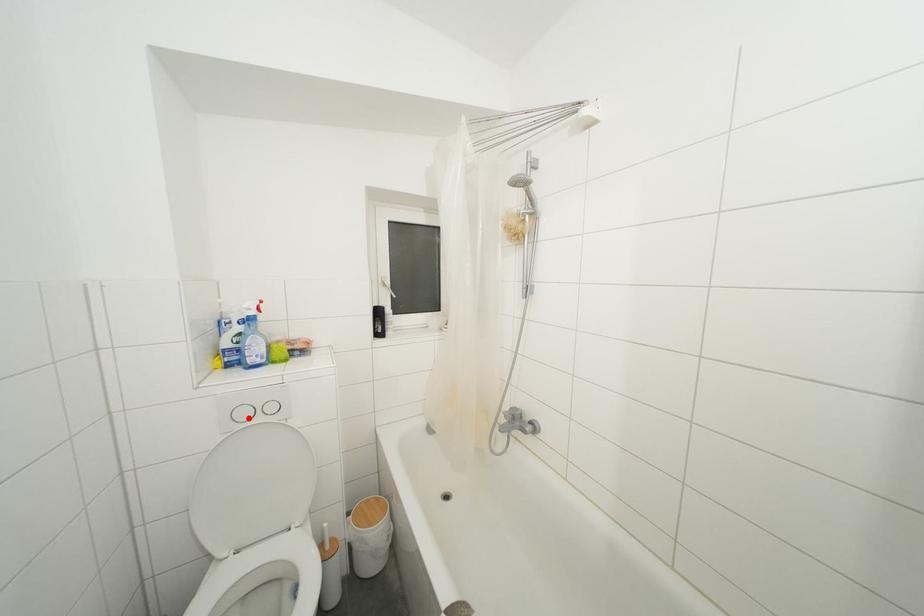
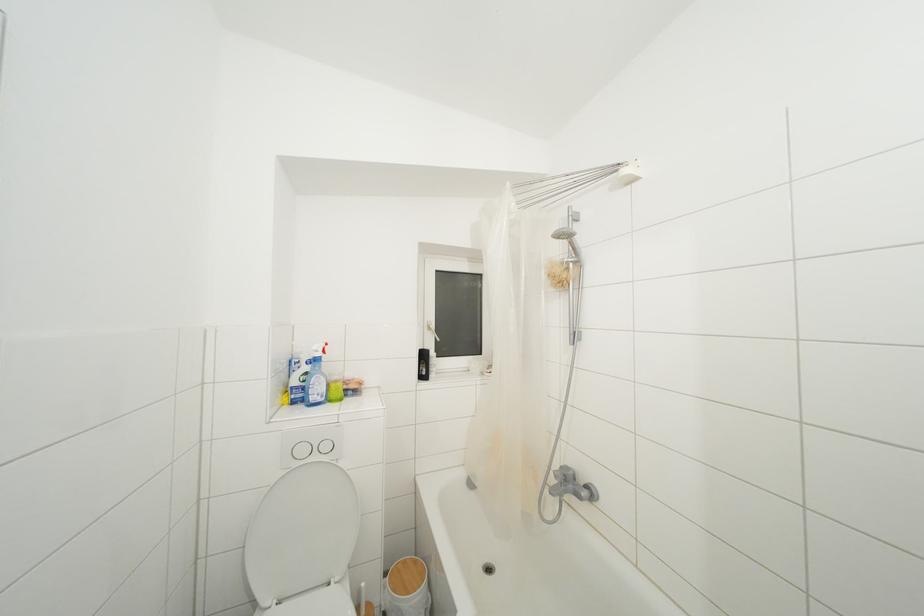
Where in the second image is the point corresponding to the highlighted location from the first image?

(307, 456)